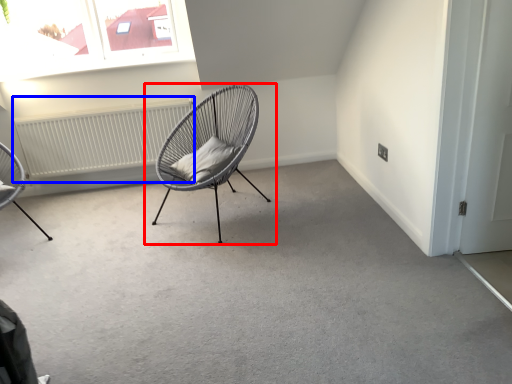
Question: Which object is further to the camera taking this photo, chair (highlighted by a red box) or radiator (highlighted by a blue box)?

Choices:
 (A) chair
 (B) radiator

Answer: (B)